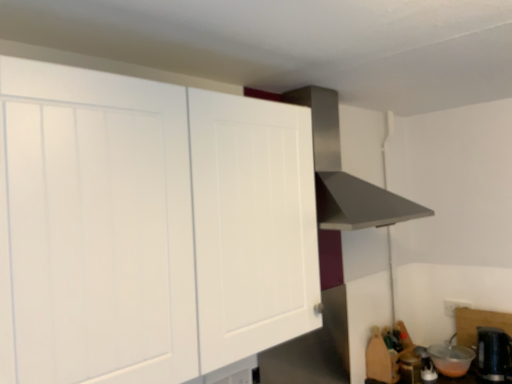
Question: From a real-world perspective, is white matte cabinet at upper left physically located above or below transparent plastic bowl at lower right, the 2th appliance viewed from the right?

Choices:
 (A) above
 (B) below

Answer: (A)

Question: In the image, is white matte cabinet at upper left on the left side or the right side of transparent plastic bowl at lower right, the 2th appliance viewed from the right?

Choices:
 (A) left
 (B) right

Answer: (A)

Question: Estimate the real-world distances between objects in this image. Which object is closer to the transparent plastic bowl at lower right, the 2th appliance viewed from the right?

Choices:
 (A) white glossy kettle at lower right, which is the 3th appliance in right-to-left order
 (B) white matte cabinet at upper left
 (C) stainless steel vent at upper center
 (D) metallic silver toaster at lower right, placed as the first appliance when sorted from left to right
 (E) black plastic kettle at lower right, the fourth appliance positioned from the left

Answer: (A)

Question: Based on their relative distances, which object is farther from the stainless steel vent at upper center?

Choices:
 (A) white glossy kettle at lower right, acting as the 2th appliance starting from the left
 (B) black plastic kettle at lower right, which ranks as the 1th appliance in right-to-left order
 (C) metallic silver toaster at lower right, placed as the first appliance when sorted from left to right
 (D) white matte cabinet at upper left
 (E) transparent plastic bowl at lower right, which appears as the third appliance when viewed from the left

Answer: (E)